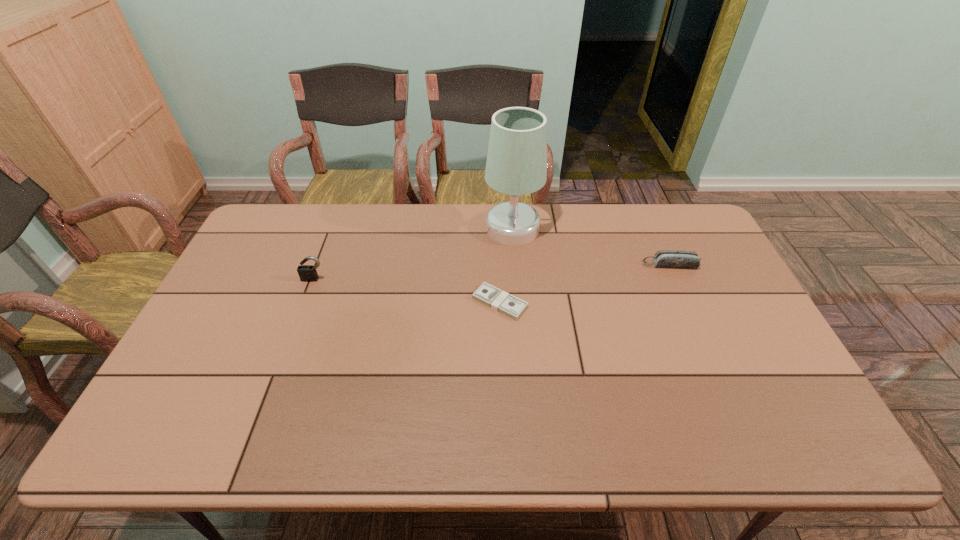
The height and width of the screenshot is (540, 960). In order to click on the tallest object in this screenshot , I will do `click(516, 161)`.

The height and width of the screenshot is (540, 960). What are the coordinates of `the farthest object` in the screenshot? It's located at (516, 161).

Find the location of `the leftmost object`. the leftmost object is located at coordinates (307, 273).

You are a GUI agent. You are given a task and a screenshot of the screen. Output one action in this format:
    pyautogui.click(x=<x>, y=<y>)
    Task: Click on the second nearest object
    
    Given the screenshot: What is the action you would take?
    pyautogui.click(x=307, y=273)

You are a GUI agent. You are given a task and a screenshot of the screen. Output one action in this format:
    pyautogui.click(x=<x>, y=<y>)
    Task: Click on the rightmost object
    The height and width of the screenshot is (540, 960).
    Given the screenshot: What is the action you would take?
    pyautogui.click(x=675, y=259)

Image resolution: width=960 pixels, height=540 pixels. I want to click on the third nearest object, so click(675, 259).

In order to click on the nearest object in this screenshot , I will do `click(499, 300)`.

Find the location of a particular element. This screenshot has width=960, height=540. dollar is located at coordinates (499, 300).

The image size is (960, 540). I want to click on free location located 0.350m on the base of the farthest object, so click(x=385, y=228).

Locate an element on the screen. vacant region located on the base of the farthest object is located at coordinates (465, 228).